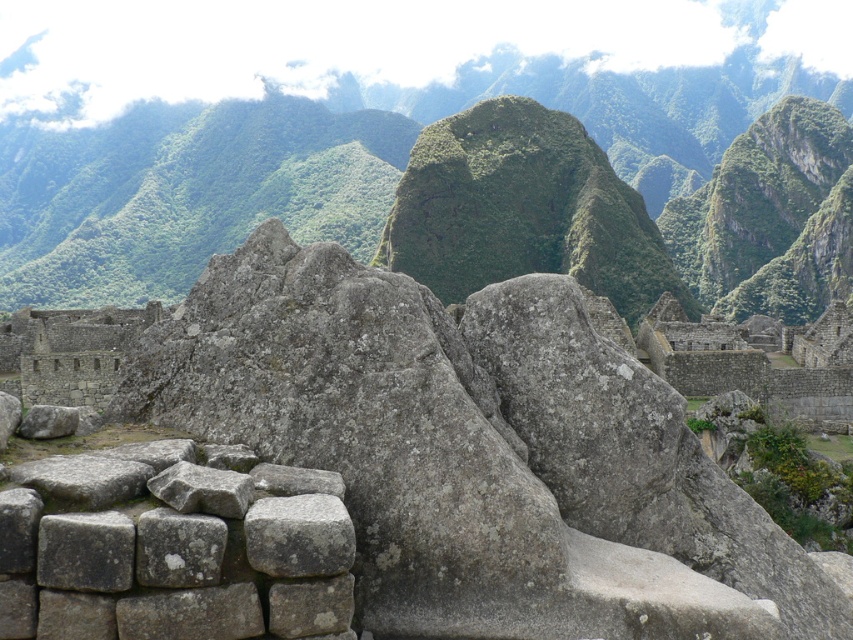
Which is below, gray stone wall at center or gray rough stone at center?

gray rough stone at center is lower down.

Image resolution: width=853 pixels, height=640 pixels. Describe the element at coordinates (468, 449) in the screenshot. I see `gray stone wall at center` at that location.

Where is `gray stone wall at center`? This screenshot has height=640, width=853. gray stone wall at center is located at coordinates (468, 449).

Is point (306, 349) positioned before point (25, 129)?

Yes, it is in front of point (25, 129).

Is gray stone wall at center shorter than green rock formation at center?

Yes.

Between point (708, 596) and point (755, 269), which one is positioned in front?

Point (708, 596) is in front.

This screenshot has width=853, height=640. Find the location of `gray stone wall at center`. gray stone wall at center is located at coordinates (468, 449).

Which is behind, point (3, 122) or point (341, 538)?

Positioned behind is point (3, 122).

Which of these two, green rock formation at center or gray rough stone at center, stands shorter?

Standing shorter between the two is gray rough stone at center.

At what (x,y) coordinates should I click in order to perform the action: click on green rock formation at center. Please return your answer as a coordinate pair (x, y). Looking at the image, I should click on (340, 164).